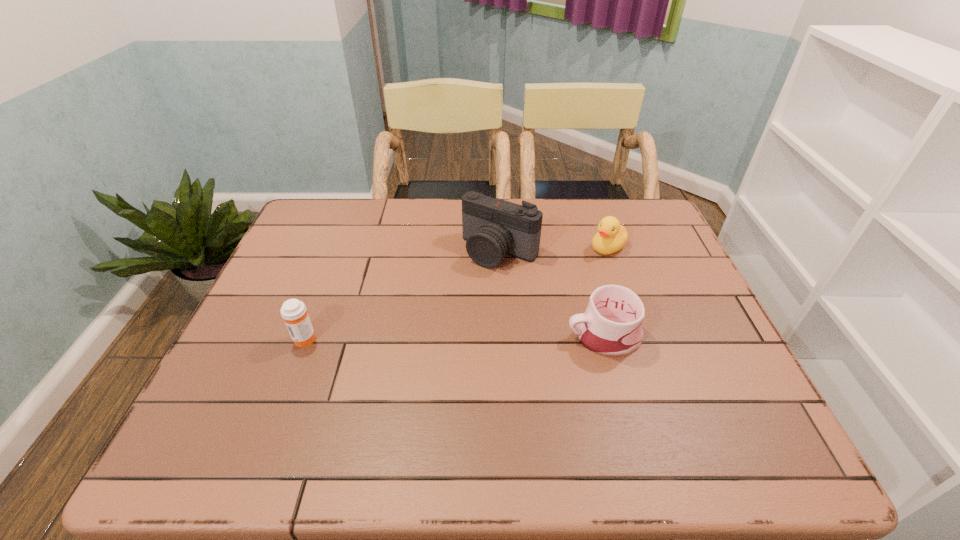
The image size is (960, 540). In order to click on vacant region located 0.160m on the face of the duckling in this screenshot , I will do `click(556, 276)`.

I want to click on free spot located 0.110m on the face of the duckling, so click(569, 269).

Identify the location of free point located 0.360m at the lens of the tallest object. This screenshot has width=960, height=540. (404, 363).

I want to click on free location located 0.380m at the lens of the tallest object, so click(399, 369).

I want to click on blank space located at the lens of the tallest object, so click(x=441, y=320).

Where is `duckling present at the far edge`? duckling present at the far edge is located at coordinates (611, 237).

Find the location of a particular element. camera present at the far edge is located at coordinates (492, 228).

Identify the location of object that is at the left edge. The image size is (960, 540). (x=293, y=311).

You are a GUI agent. You are given a task and a screenshot of the screen. Output one action in this format:
    pyautogui.click(x=<x>, y=<y>)
    Task: Click on the object at the right edge
    
    Given the screenshot: What is the action you would take?
    pyautogui.click(x=611, y=237)

Identify the location of object present at the far right corner. The width and height of the screenshot is (960, 540). (611, 237).